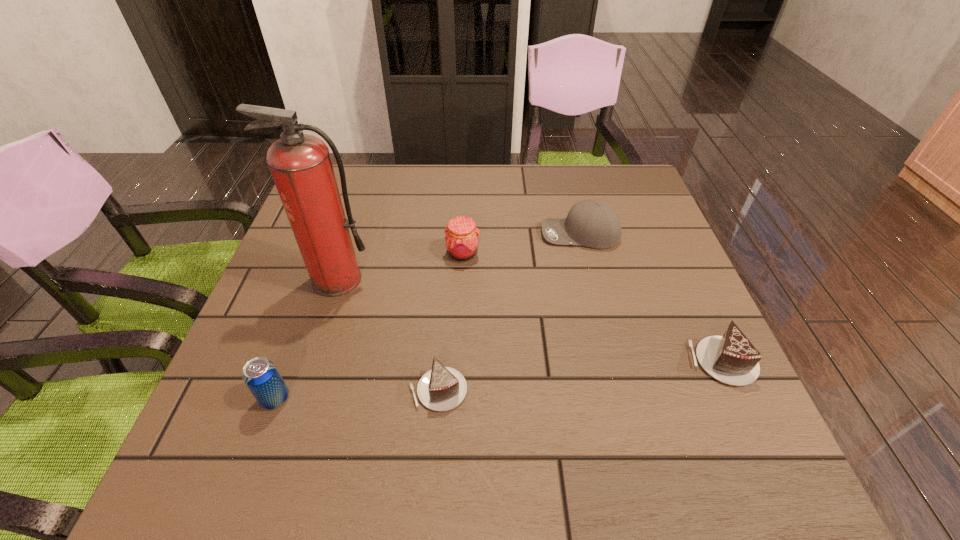
Please point a space for a new chocolate_cake to maintain equal intervals. Please provide its 2D coordinates. Your answer should be formatted as a tuple, i.e. [(x, y)], where the tuple contains the x and y coordinates of a point satisfying the conditions above.

[(584, 375)]